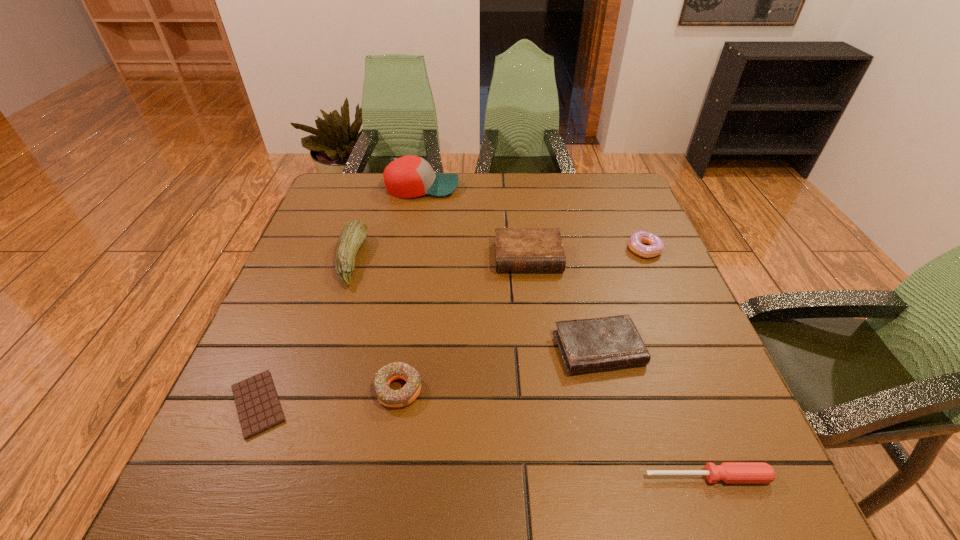
Find the location of a particular element. The height and width of the screenshot is (540, 960). the farthest object is located at coordinates (410, 176).

The width and height of the screenshot is (960, 540). What are the coordinates of `baseball cap` in the screenshot? It's located at (410, 176).

At what (x,y) coordinates should I click in order to perform the action: click on the second tallest object. Please return your answer as a coordinate pair (x, y). Image resolution: width=960 pixels, height=540 pixels. Looking at the image, I should click on (354, 232).

Image resolution: width=960 pixels, height=540 pixels. I want to click on the sixth shortest object, so click(x=516, y=249).

I want to click on the farther diary, so tap(516, 249).

What are the coordinates of `the right doughnut` in the screenshot? It's located at (656, 245).

Where is `the nearer doughnut`? This screenshot has height=540, width=960. the nearer doughnut is located at coordinates (409, 392).

Where is `the nearer diary`? The image size is (960, 540). the nearer diary is located at coordinates (604, 343).

At what (x,y) coordinates should I click in order to perform the action: click on the nearest object. Please return your answer as a coordinate pair (x, y). This screenshot has height=540, width=960. Looking at the image, I should click on (730, 472).

In order to click on screwdriver in this screenshot , I will do `click(730, 472)`.